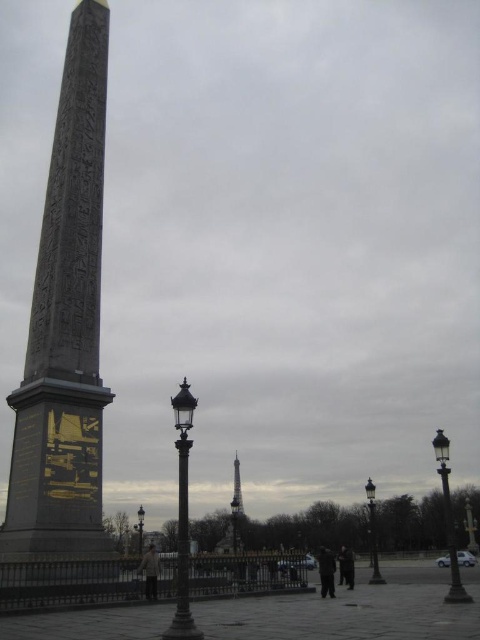
You are a fashion designer observing a person standing at Place de la Concorde. You notice the dark gray fabric pants at center and the dark gray jacket at lower center. Which clothing item appears taller in the image?

The dark gray fabric pants at center appears taller than the dark gray jacket at lower center in the image.

You are a tourist standing at Place de la Concorde in Paris. You see the black polished stone obelisk at left and the dark gray fabric pants at center. Which object is located to the left of the other?

The black polished stone obelisk at left is positioned on the left side of dark gray fabric pants at center.

You are a fashion designer observing a person standing at Place de la Concorde in Paris. You notice the dark gray fabric pants at center and the dark gray jacket at lower center. Which clothing item is positioned higher on the person?

The dark gray fabric pants at center are located above the dark gray jacket at lower center, so the pants are positioned higher on the person.